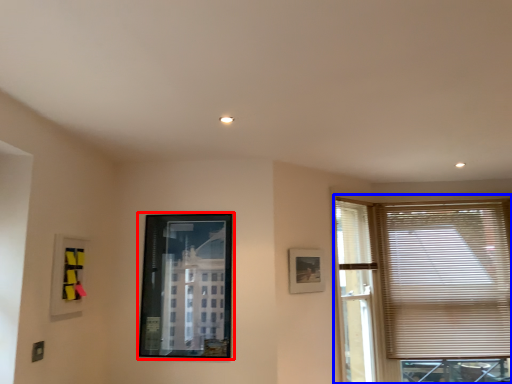
Question: Which object is closer to the camera taking this photo, picture frame (highlighted by a red box) or window (highlighted by a blue box)?

Choices:
 (A) picture frame
 (B) window

Answer: (A)